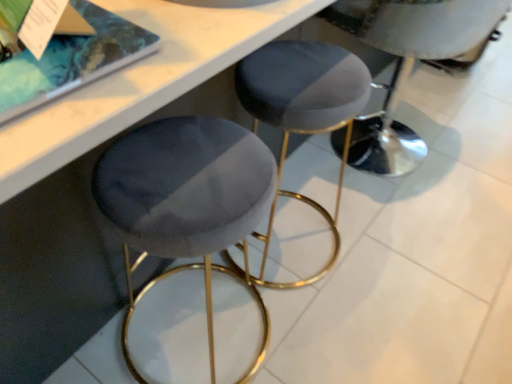
What are the coordinates of `free space above velvet grey stool at center (from a real-world perspective)` in the screenshot? It's located at (306, 69).